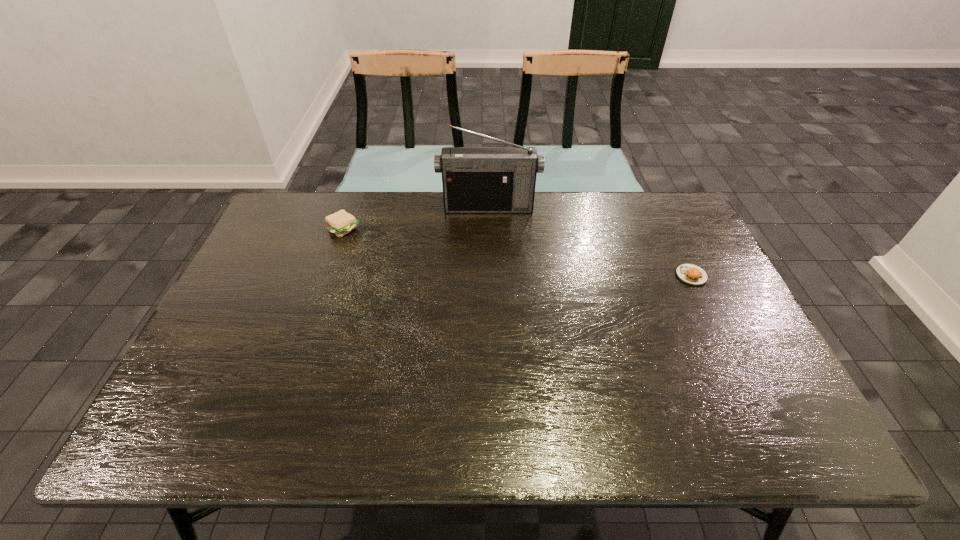
Identify the location of patty located in the far edge section of the desktop. (340, 223).

Locate an element on the screen. The width and height of the screenshot is (960, 540). object that is positioned at the right edge is located at coordinates (690, 274).

In the image, there is a desktop. Where is `vacant space at the far edge`? The width and height of the screenshot is (960, 540). vacant space at the far edge is located at coordinates (634, 220).

The width and height of the screenshot is (960, 540). I want to click on vacant space at the near edge of the desktop, so click(329, 423).

I want to click on vacant space at the left edge, so click(205, 338).

Find the location of a particular element. The image size is (960, 540). free location at the right edge of the desktop is located at coordinates (716, 300).

This screenshot has width=960, height=540. In order to click on vacant space at the near right corner of the desktop in this screenshot , I will do `click(772, 421)`.

In order to click on blank region between the nearest object and the tallest object in this screenshot , I will do `click(589, 241)`.

In order to click on vacant area that lies between the second nearest object and the second object from right to left in this screenshot , I will do `click(417, 218)`.

You are a GUI agent. You are given a task and a screenshot of the screen. Output one action in this format:
    pyautogui.click(x=<x>, y=<y>)
    Task: Click on the free space between the rightmost object and the radio receiver
    
    Given the screenshot: What is the action you would take?
    pyautogui.click(x=589, y=241)